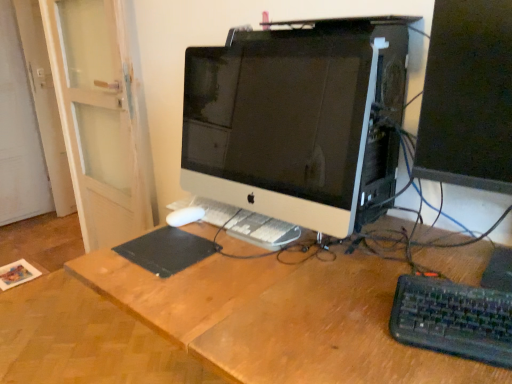
Question: From a real-world perspective, is black plastic keyboard at lower right positioned under matte black monitor at right, which is counted as the first computer monitor, starting from the right, based on gravity?

Choices:
 (A) yes
 (B) no

Answer: (A)

Question: From the image's perspective, is black plastic keyboard at lower right located above matte black monitor at right, the 2th computer monitor from the left?

Choices:
 (A) no
 (B) yes

Answer: (A)

Question: Considering the relative sizes of black plastic keyboard at lower right and matte black monitor at right, which is counted as the first computer monitor, starting from the right, in the image provided, is black plastic keyboard at lower right bigger than matte black monitor at right, which is counted as the first computer monitor, starting from the right,?

Choices:
 (A) no
 (B) yes

Answer: (A)

Question: Could you tell me if black plastic keyboard at lower right is turned towards matte black monitor at right, the 2th computer monitor from the left?

Choices:
 (A) yes
 (B) no

Answer: (B)

Question: From a real-world perspective, is black plastic keyboard at lower right located higher than matte black monitor at right, the 2th computer monitor from the left?

Choices:
 (A) yes
 (B) no

Answer: (B)

Question: From a real-world perspective, is white glossy computer monitor at center, the first computer monitor viewed from the left, positioned above or below black matte mousepad at center?

Choices:
 (A) above
 (B) below

Answer: (A)

Question: Considering their positions, is white glossy computer monitor at center, which is counted as the 2th computer monitor, starting from the right, located in front of or behind black matte mousepad at center?

Choices:
 (A) behind
 (B) front

Answer: (B)

Question: Is white glossy computer monitor at center, which is counted as the 2th computer monitor, starting from the right, inside or outside of black matte mousepad at center?

Choices:
 (A) inside
 (B) outside

Answer: (B)

Question: In the image, is white glossy computer monitor at center, the first computer monitor viewed from the left, on the left side or the right side of black matte mousepad at center?

Choices:
 (A) left
 (B) right

Answer: (B)

Question: Is black matte mousepad at center in front of or behind white glossy computer monitor at center, which is counted as the 2th computer monitor, starting from the right, in the image?

Choices:
 (A) behind
 (B) front

Answer: (A)

Question: Considering the positions of point (207, 243) and point (279, 66), is point (207, 243) closer or farther from the camera than point (279, 66)?

Choices:
 (A) closer
 (B) farther

Answer: (B)

Question: From the image's perspective, is black matte mousepad at center above or below white glossy computer monitor at center, the first computer monitor viewed from the left?

Choices:
 (A) below
 (B) above

Answer: (A)

Question: Considering the relative positions of black matte mousepad at center and white glossy computer monitor at center, which is counted as the 2th computer monitor, starting from the right, in the image provided, is black matte mousepad at center to the left or to the right of white glossy computer monitor at center, which is counted as the 2th computer monitor, starting from the right,?

Choices:
 (A) left
 (B) right

Answer: (A)

Question: Considering the positions of point (328, 296) and point (472, 292), is point (328, 296) closer or farther from the camera than point (472, 292)?

Choices:
 (A) closer
 (B) farther

Answer: (B)

Question: In the image, is wooden desk at center on the left side or the right side of black plastic keyboard at lower right?

Choices:
 (A) right
 (B) left

Answer: (B)